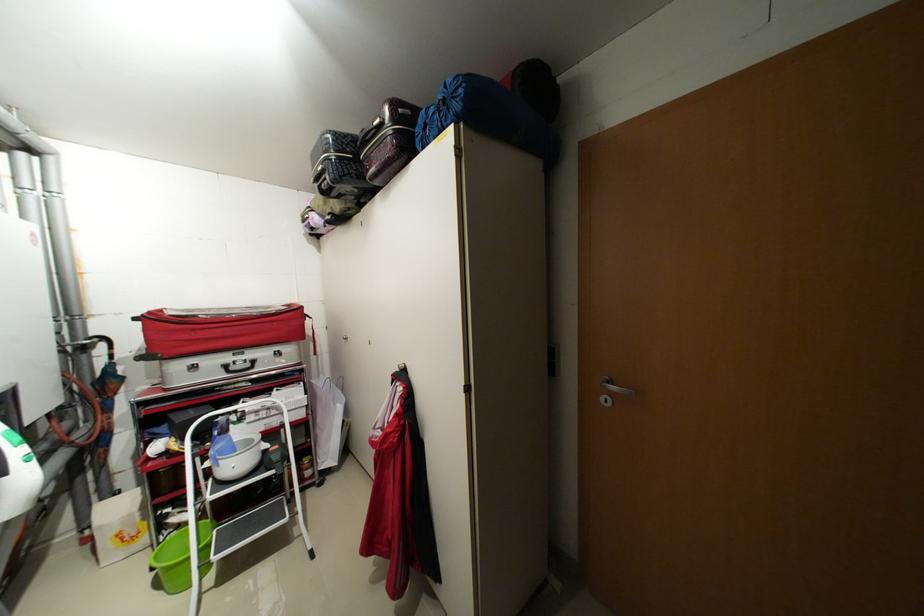
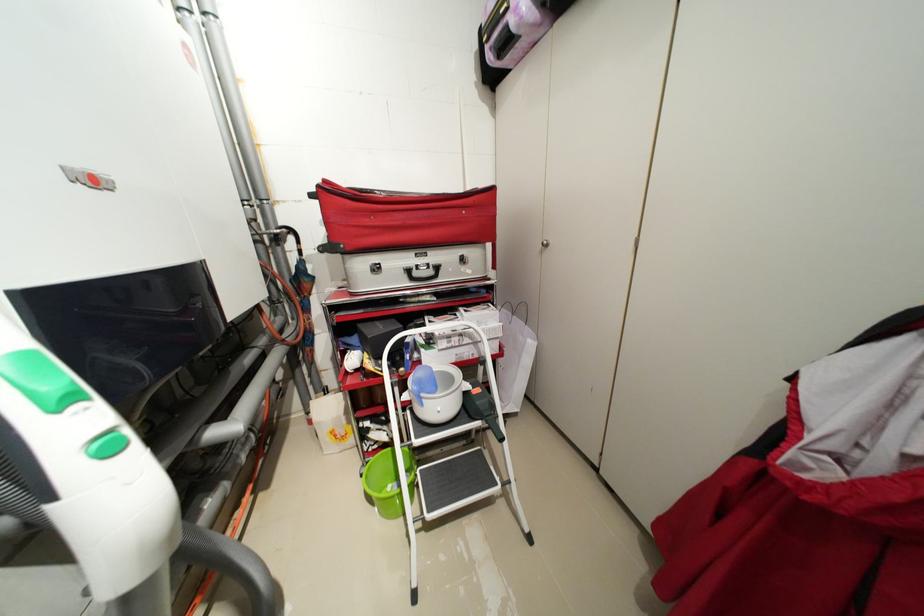
Locate, in the second image, the point that corresponds to the point at 311,418 in the first image.

(505, 352)